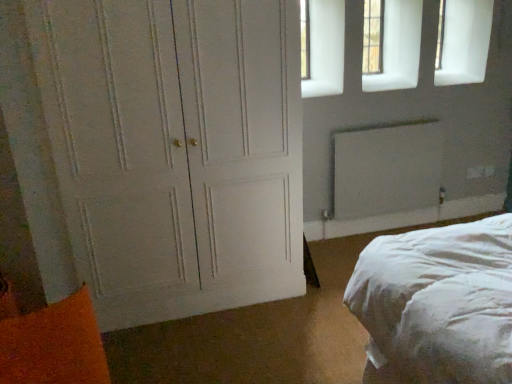
At what (x,y) coordinates should I click in order to perform the action: click on free space in front of white painted wood door at left. Please return your answer as a coordinate pair (x, y). Image resolution: width=512 pixels, height=384 pixels. Looking at the image, I should click on (230, 347).